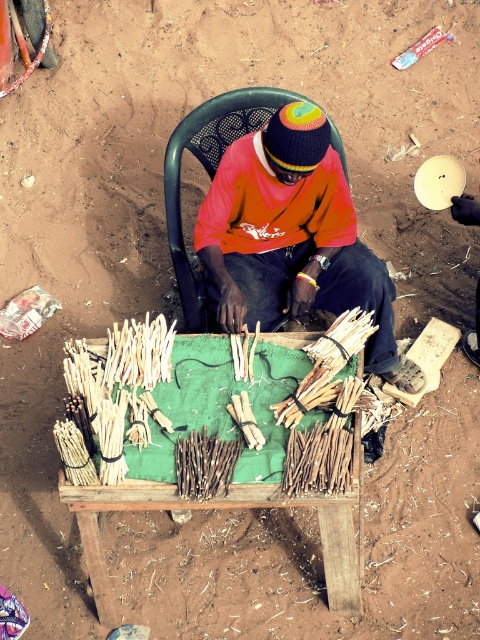
Does brown natural reed at center have a smaller size compared to brown wood reed at center?

Correct, brown natural reed at center occupies less space than brown wood reed at center.

How much distance is there between brown natural reed at center and brown wood reed at center?

brown natural reed at center and brown wood reed at center are 9.70 inches apart.

Is point (323, 461) closer to camera compared to point (225, 474)?

Yes, point (323, 461) is in front of point (225, 474).

What are the coordinates of `brown natural reed at center` in the screenshot? It's located at (317, 460).

Does point (228, 496) come closer to viewer compared to point (227, 481)?

No, (228, 496) is behind (227, 481).

I want to click on wooden sticks at center, so click(227, 508).

Image resolution: width=480 pixels, height=640 pixels. I want to click on bamboo sticks at center, so click(325, 364).

Does bamboo sticks at center have a larger size compared to brown wood reed at center?

Yes, bamboo sticks at center is bigger than brown wood reed at center.

Who is more distant from viewer, (278, 403) or (231, 461)?

The point (278, 403) is behind.

I want to click on bamboo sticks at center, so click(325, 364).